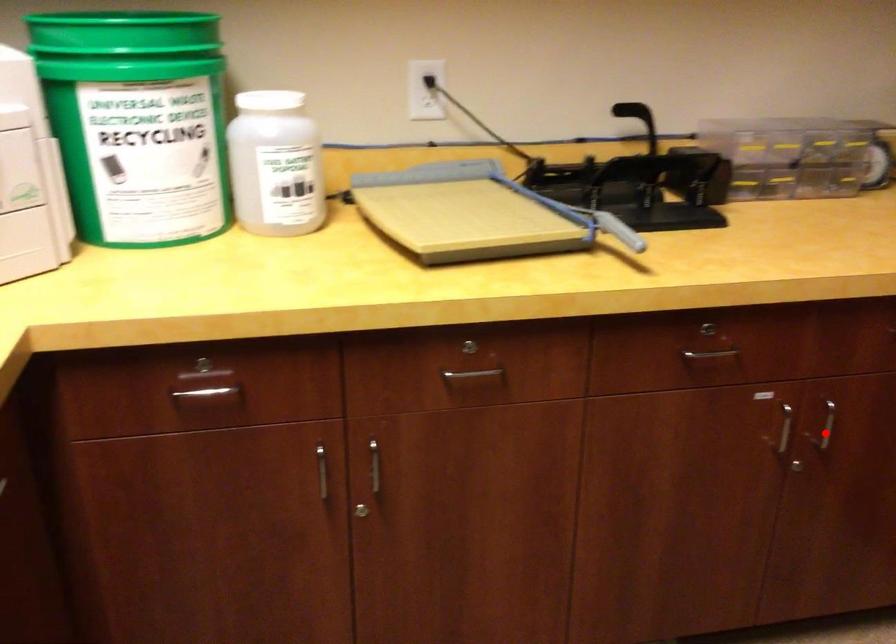
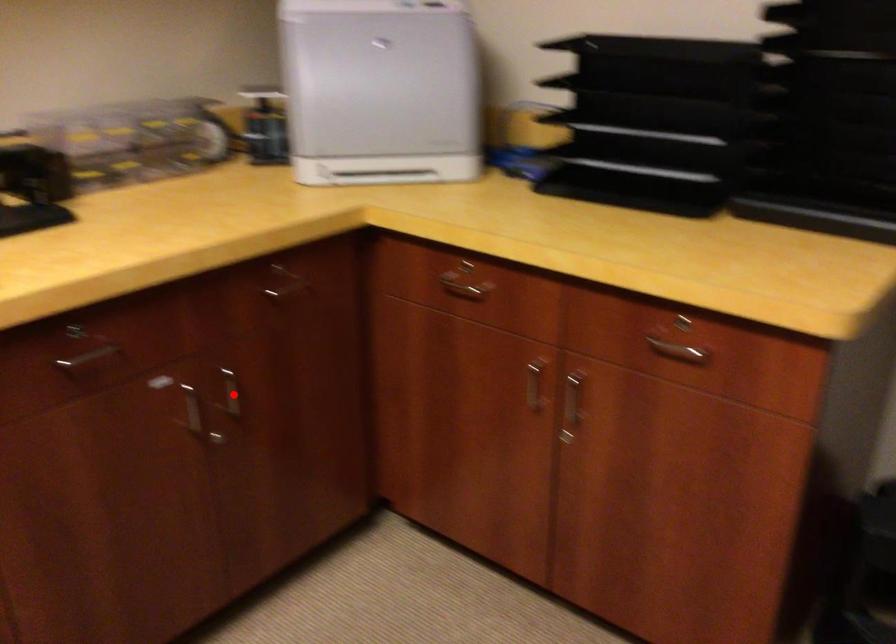
I am providing you with two images of the same scene from different viewpoints. A red point is marked on the first image and another point is marked on the second image. Do the highlighted points in image1 and image2 indicate the same real-world spot?

Yes